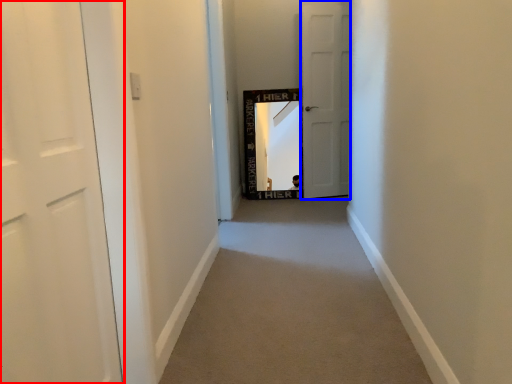
Question: Which point is further to the camera, door (highlighted by a red box) or door (highlighted by a blue box)?

Choices:
 (A) door
 (B) door

Answer: (B)